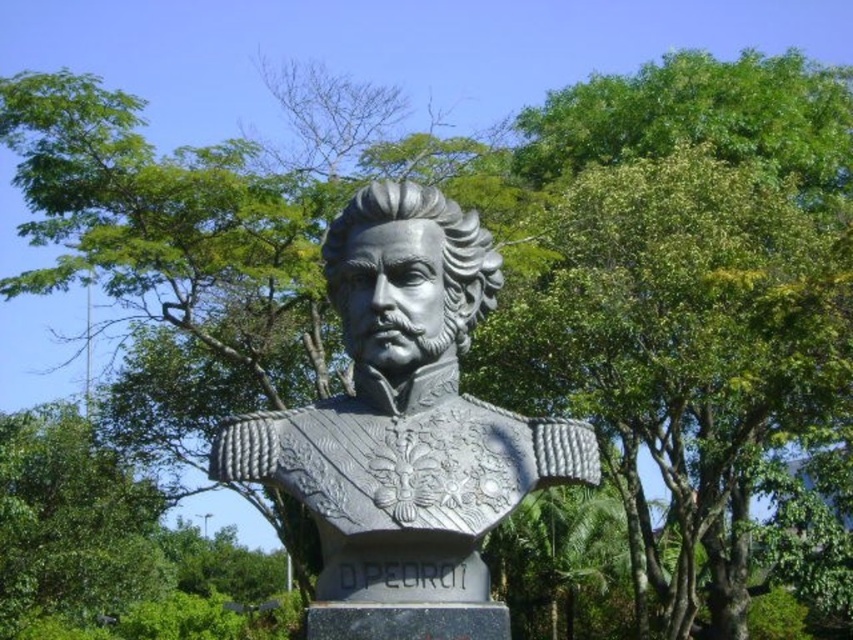
Does polished bronze bust at center have a greater height compared to green leafy tree at center?

In fact, polished bronze bust at center may be shorter than green leafy tree at center.

Does point (519, 477) come closer to viewer compared to point (141, 509)?

That is True.

Is point (473, 211) more distant than point (120, 502)?

That is False.

Find the location of a particular element. polished bronze bust at center is located at coordinates (405, 412).